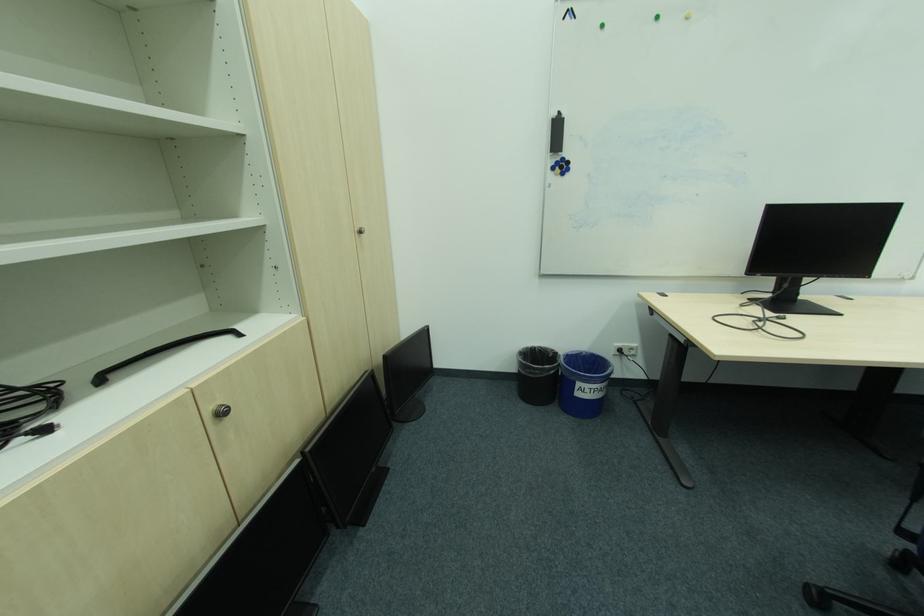
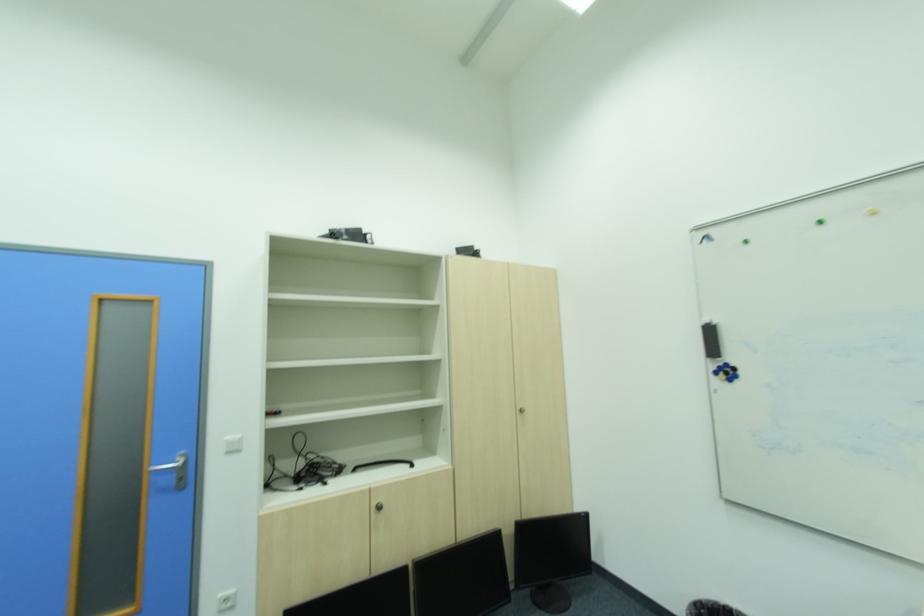
Where in the second image is the point corresponding to point 533,349 from the first image?

(723, 604)